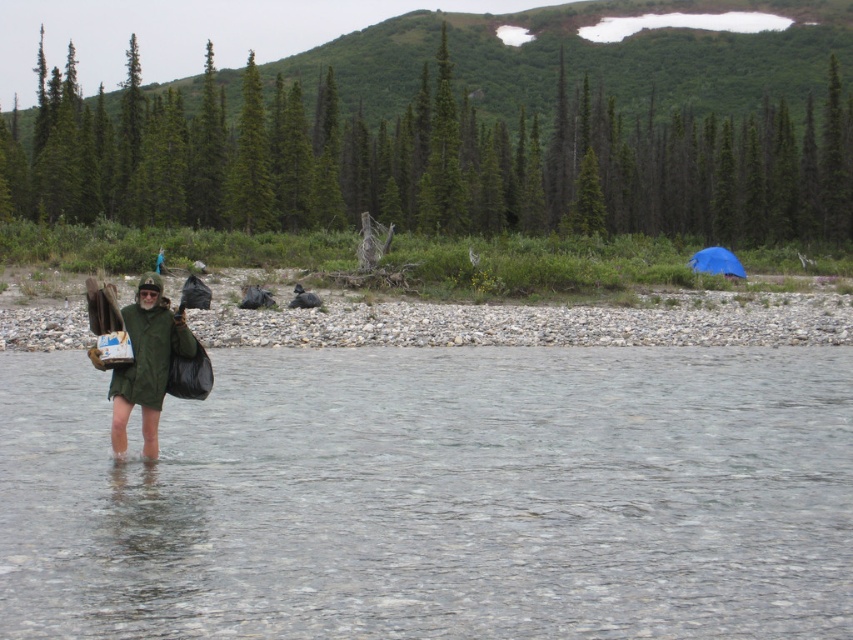
Describe the element at coordinates (146, 362) in the screenshot. I see `green matte jacket at center` at that location.

Is green matte jacket at center bigger than blue tarp at right?

Incorrect, green matte jacket at center is not larger than blue tarp at right.

Between point (135, 316) and point (705, 266), which one is positioned behind?

The point (705, 266) is behind.

Locate an element on the screen. The width and height of the screenshot is (853, 640). green matte jacket at center is located at coordinates (146, 362).

Between clear water at center and blue tarp at right, which one has more height?

Standing taller between the two is blue tarp at right.

Describe the element at coordinates (436, 497) in the screenshot. The width and height of the screenshot is (853, 640). I see `clear water at center` at that location.

This screenshot has width=853, height=640. What are the coordinates of `clear water at center` in the screenshot? It's located at (436, 497).

You are a GUI agent. You are given a task and a screenshot of the screen. Output one action in this format:
    pyautogui.click(x=<x>, y=<y>)
    Task: Click on the clear water at center
    This screenshot has height=640, width=853.
    Given the screenshot: What is the action you would take?
    pyautogui.click(x=436, y=497)

Does point (299, 461) come closer to viewer compared to point (115, 449)?

No, it is behind (115, 449).

Image resolution: width=853 pixels, height=640 pixels. Describe the element at coordinates (436, 497) in the screenshot. I see `clear water at center` at that location.

Identify the location of clear water at center. The width and height of the screenshot is (853, 640). (436, 497).